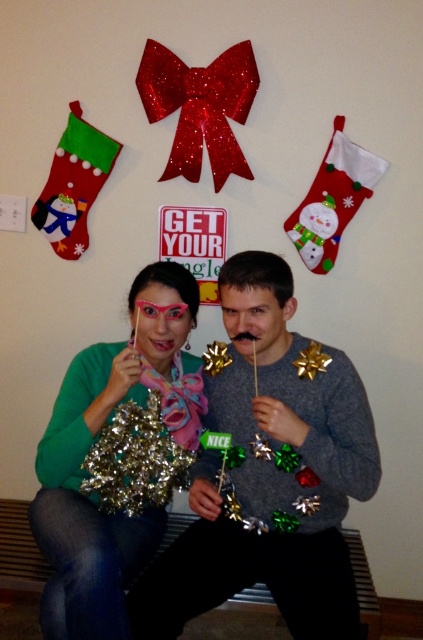
Question: Can you confirm if gray sweater at center is positioned to the left of metallic gold tinsel at left?

Choices:
 (A) no
 (B) yes

Answer: (A)

Question: Does gray sweater at center have a lesser width compared to metallic gold tinsel at left?

Choices:
 (A) yes
 (B) no

Answer: (B)

Question: Is gray sweater at center to the left of metallic gold tinsel at left from the viewer's perspective?

Choices:
 (A) yes
 (B) no

Answer: (B)

Question: Which point is closer to the camera?

Choices:
 (A) metallic gold tinsel at left
 (B) gray sweater at center

Answer: (A)

Question: Which object is closer to the camera taking this photo?

Choices:
 (A) metallic gold tinsel at left
 (B) gray sweater at center

Answer: (A)